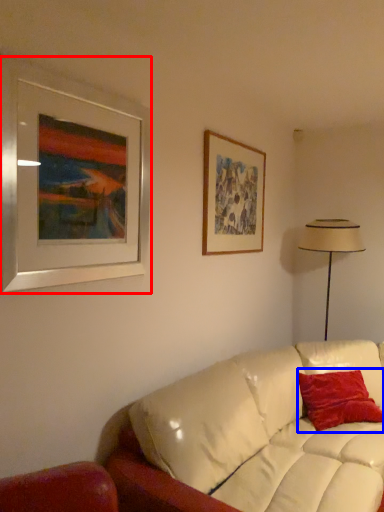
Question: Which object appears farthest to the camera in this image, picture frame (highlighted by a red box) or pillow (highlighted by a blue box)?

Choices:
 (A) picture frame
 (B) pillow

Answer: (B)